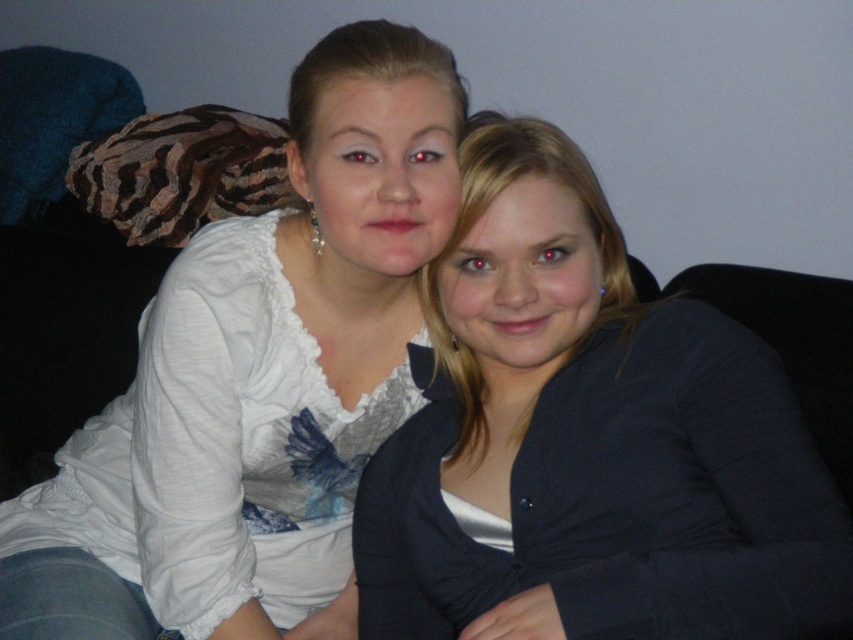
You are a fashion designer observing the two garments in the image. Which garment appears shorter in height between the matte black blazer at center and the white satin blouse at upper left?

Answer: The matte black blazer at center has a lesser height compared to the white satin blouse at upper left, so the matte black blazer at center is shorter in height.

You are a fashion designer observing two clothing items in the image. The matte black blazer at center and the white satin blouse at upper left. Which clothing item is positioned to the right of the other?

The matte black blazer at center is to the right of the white satin blouse at upper left.

You are a tailor measuring the distance between the matte black blazer at center and the white satin blouse at upper left for a fitting. The minimum required distance for proper measurement is 8 inches. Can you measure them as they are now?

The matte black blazer at center is 7.28 inches away from the white satin blouse at upper left, which is less than the required 8 inches. Therefore, you cannot measure them as they are now.